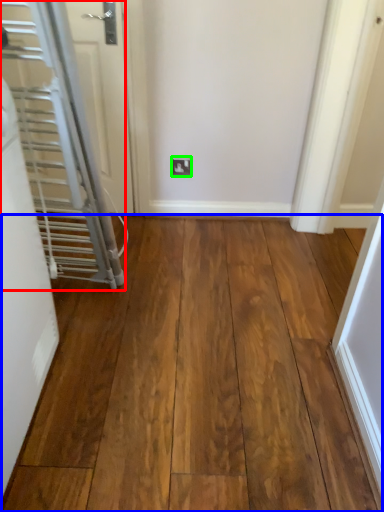
Question: Which object is the farthest from door (highlighted by a red box)? Choose among these: hardwood (highlighted by a blue box) or electric outlet (highlighted by a green box).

Choices:
 (A) hardwood
 (B) electric outlet

Answer: (B)